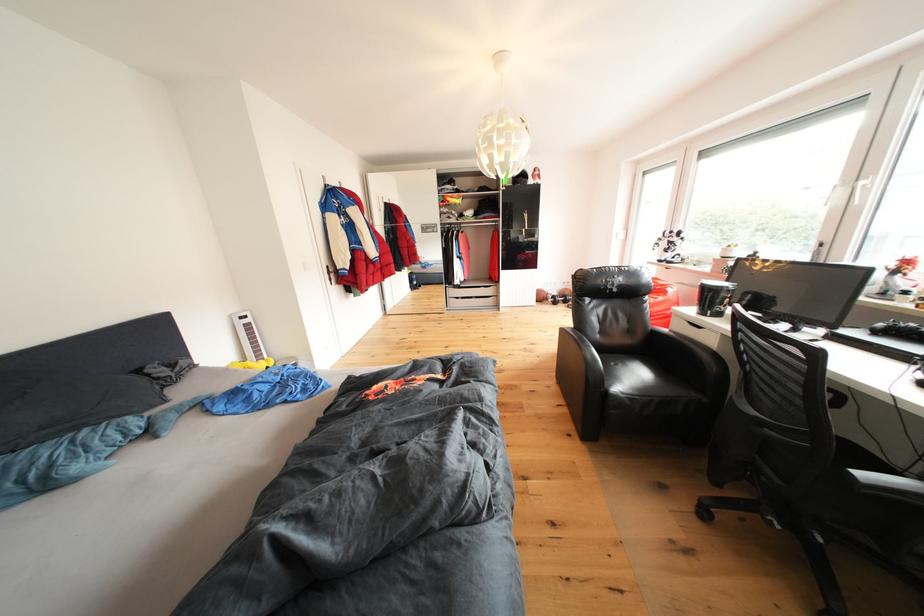
This screenshot has width=924, height=616. In order to click on black leather sitting surface in this screenshot , I will do `click(707, 345)`.